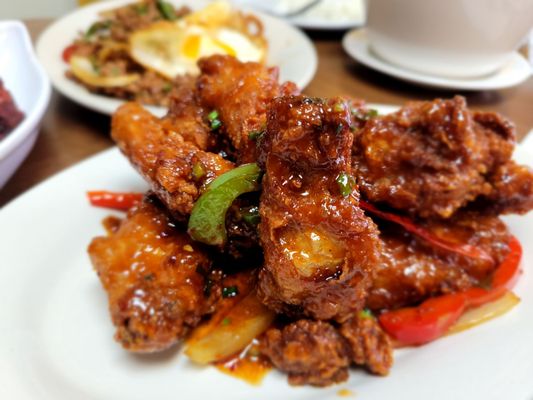
Identify the location of wall. This screenshot has width=533, height=400. pos(31,3).